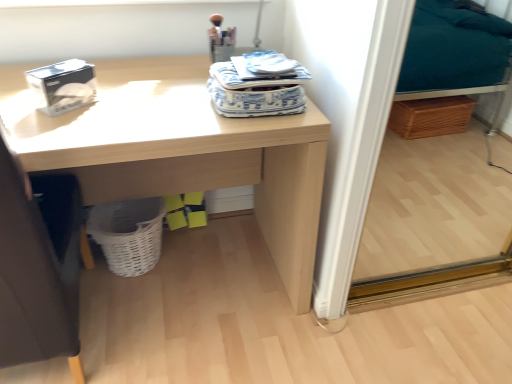
This screenshot has width=512, height=384. What are the coordinates of `vacant area in front of white woven basket at lower left` in the screenshot? It's located at (130, 301).